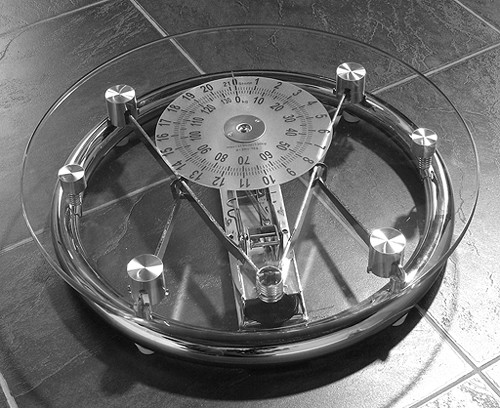
Locate an element on the screen. This screenshot has height=408, width=500. glass top is located at coordinates (44, 141), (211, 57), (394, 80), (463, 183).